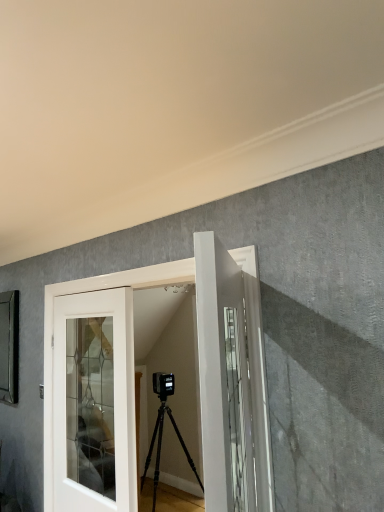
Question: Should I look upward or downward to see white glossy door at center, which is the 1th door from front to back?

Choices:
 (A) up
 (B) down

Answer: (B)

Question: From the image's perspective, is white glossy door at center, the 2th door viewed from the front, beneath white glass door at center, marked as the third door in a front-to-back arrangement?

Choices:
 (A) no
 (B) yes

Answer: (A)

Question: From a real-world perspective, is white glossy door at center, the second door viewed from the back, positioned under white glass door at center, which is the first door from back to front, based on gravity?

Choices:
 (A) no
 (B) yes

Answer: (A)

Question: Is white glass door at center, marked as the third door in a front-to-back arrangement, at the back of white glossy door at center, the 2th door viewed from the front?

Choices:
 (A) no
 (B) yes

Answer: (B)

Question: Is white glossy door at center, the 2th door viewed from the front, behind white glass door at center, which is the first door from back to front?

Choices:
 (A) yes
 (B) no

Answer: (B)

Question: Considering the relative sizes of white glossy door at center, the 2th door viewed from the front, and white glass door at center, which is the first door from back to front, in the image provided, is white glossy door at center, the 2th door viewed from the front, thinner than white glass door at center, which is the first door from back to front,?

Choices:
 (A) yes
 (B) no

Answer: (B)

Question: Considering the relative sizes of white glossy door at center, the 2th door viewed from the front, and white glass door at center, marked as the third door in a front-to-back arrangement, in the image provided, is white glossy door at center, the 2th door viewed from the front, taller than white glass door at center, marked as the third door in a front-to-back arrangement,?

Choices:
 (A) yes
 (B) no

Answer: (A)

Question: Is white glass door at center, which is the first door from back to front, to the right of white glossy door at center, which is the 1th door from front to back, from the viewer's perspective?

Choices:
 (A) yes
 (B) no

Answer: (B)

Question: Does white glass door at center, which is the first door from back to front, have a greater height compared to white glossy door at center, which is the 1th door from front to back?

Choices:
 (A) no
 (B) yes

Answer: (B)

Question: Are white glass door at center, marked as the third door in a front-to-back arrangement, and white glossy door at center, which is the 1th door from front to back, far apart?

Choices:
 (A) no
 (B) yes

Answer: (B)

Question: From the image's perspective, is white glass door at center, which is the first door from back to front, beneath white glossy door at center, placed as the third door when sorted from back to front?

Choices:
 (A) yes
 (B) no

Answer: (A)

Question: Does white glass door at center, marked as the third door in a front-to-back arrangement, come in front of white glossy door at center, which is the 1th door from front to back?

Choices:
 (A) no
 (B) yes

Answer: (A)

Question: Is white glass door at center, marked as the third door in a front-to-back arrangement, surrounding white glossy door at center, placed as the third door when sorted from back to front?

Choices:
 (A) no
 (B) yes

Answer: (A)

Question: Can you confirm if white glossy door at center, the 2th door viewed from the front, is positioned to the left of white glossy door at center, which is the 1th door from front to back?

Choices:
 (A) yes
 (B) no

Answer: (A)